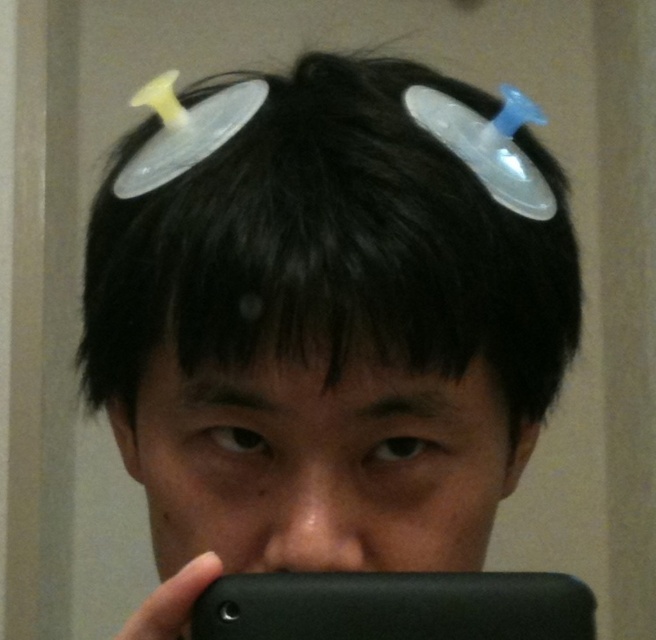
You are a photographer trying to capture the perfect selfie. The person in the image has black matte hair at upper center. Where exactly should you position your camera to ensure the hair is centered in the frame?

The black matte hair at upper center is located at point (331,248), so position your camera to center the frame on those coordinates to capture the hair precisely.

Looking at this image, you are a photographer trying to frame a portrait. The subject has black matte hair at upper center and is holding a black matte smartphone at lower center. Which object is positioned higher in the frame?

The black matte hair at upper center is positioned higher in the frame compared to the black matte smartphone at lower center because it has a greater height.